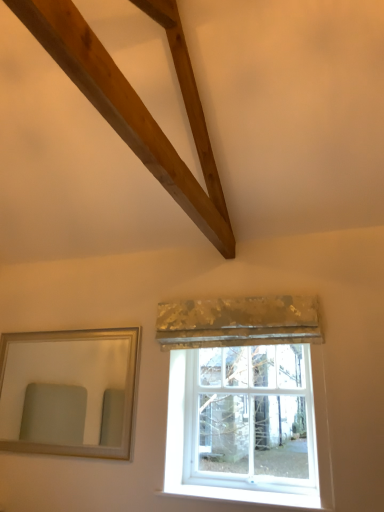
Question: From the image's perspective, is silver/golden-framed mirror at left located above or below white glass window at center?

Choices:
 (A) below
 (B) above

Answer: (B)

Question: Considering the positions of point (96, 426) and point (306, 436), is point (96, 426) closer or farther from the camera than point (306, 436)?

Choices:
 (A) farther
 (B) closer

Answer: (A)

Question: Which object is the farthest from the white glass window at center?

Choices:
 (A) silver/golden-framed mirror at left
 (B) gold sequined curtain at center

Answer: (A)

Question: Estimate the real-world distances between objects in this image. Which object is closer to the gold sequined curtain at center?

Choices:
 (A) white glass window at center
 (B) silver/golden-framed mirror at left

Answer: (A)